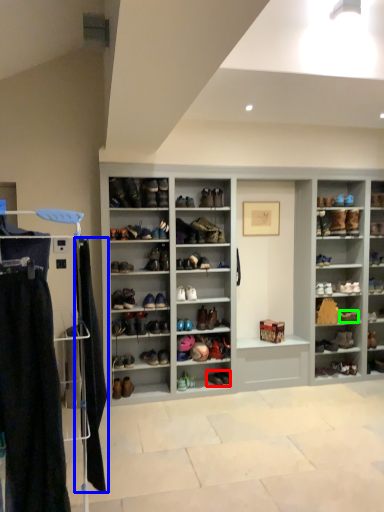
Question: Considering the real-world distances, which object is farthest from footwear (highlighted by a red box)? clothing (highlighted by a blue box) or shoe (highlighted by a green box)?

Choices:
 (A) clothing
 (B) shoe

Answer: (A)